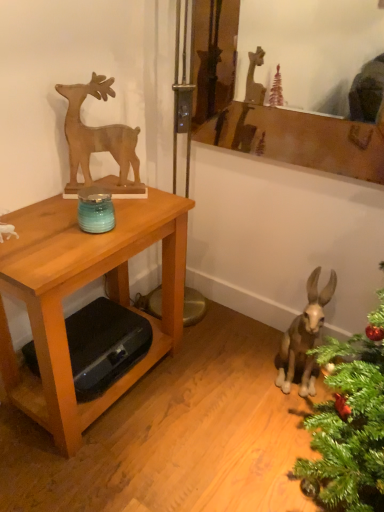
Image resolution: width=384 pixels, height=512 pixels. I want to click on vacant space in front of brown matte donkey at lower right, so click(x=284, y=418).